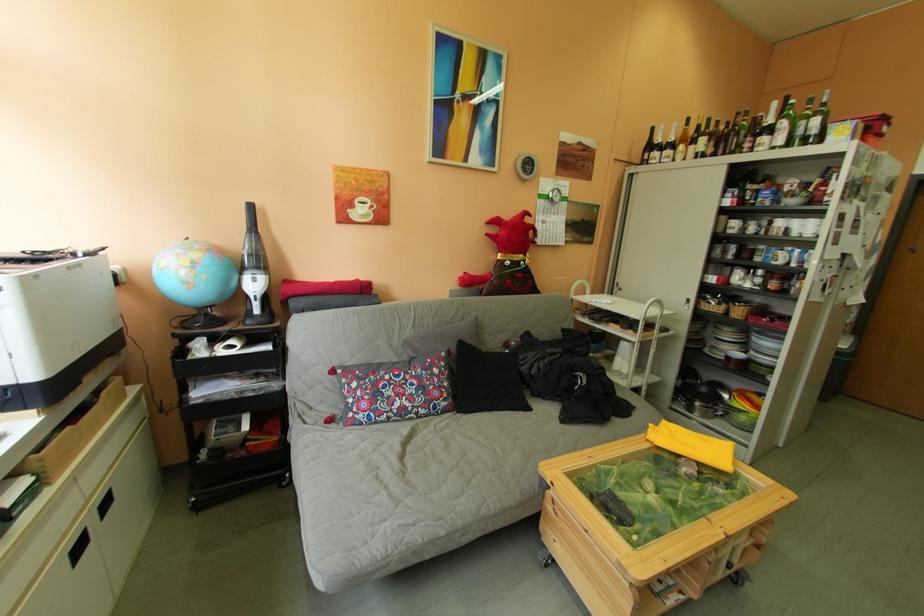
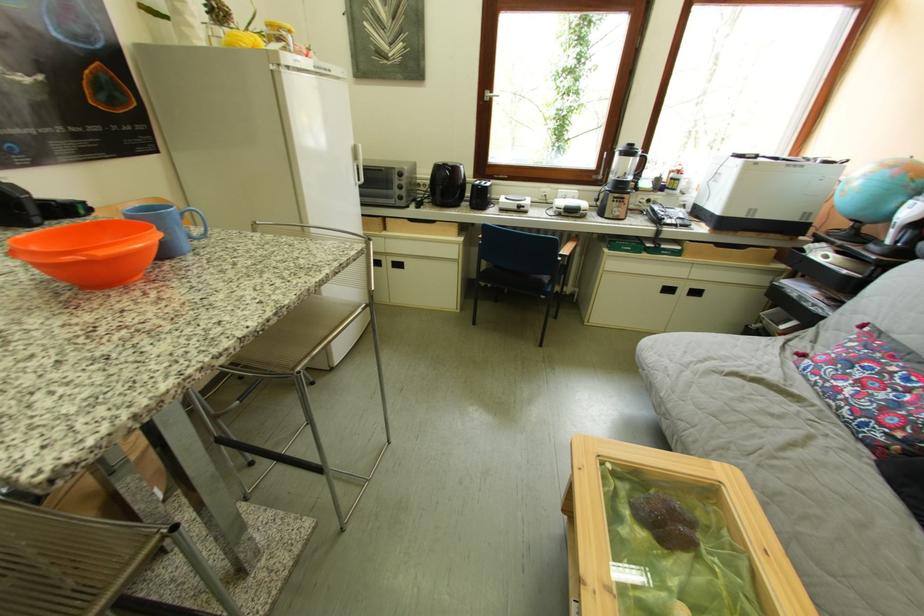
In the second image, find the point that corresponds to pixel 37 484 in the first image.

(690, 251)